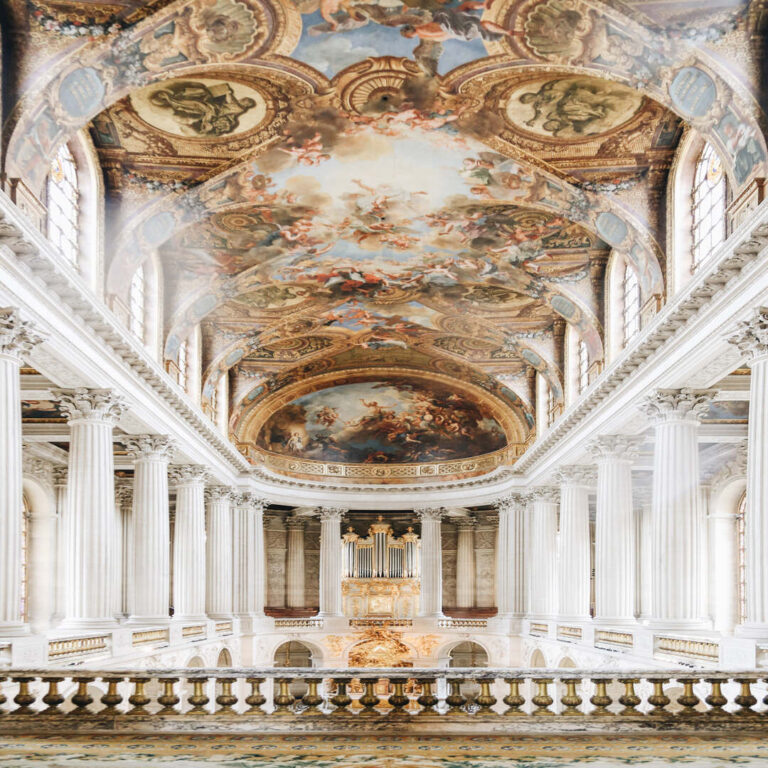
Where is `large dome on ceiling`? large dome on ceiling is located at coordinates (355, 416).